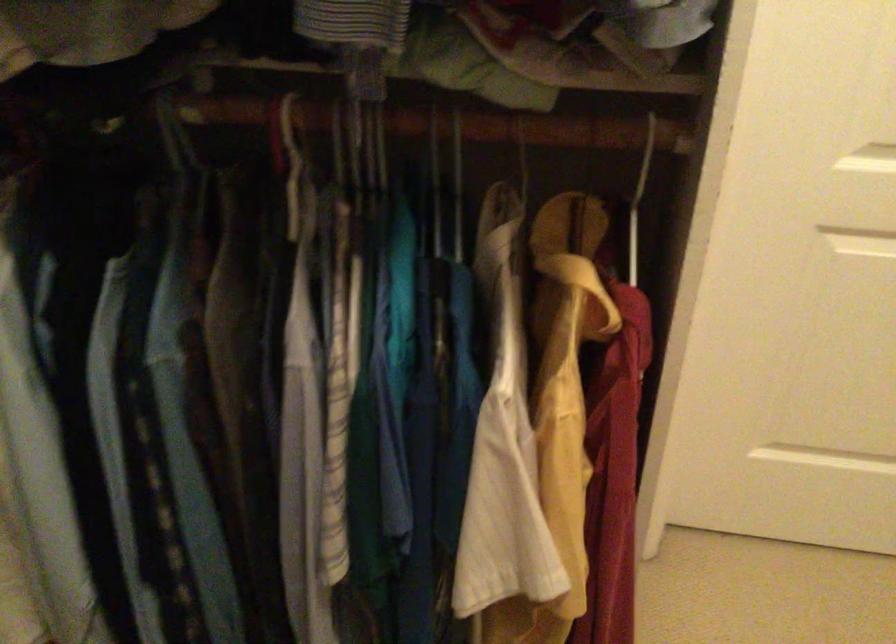
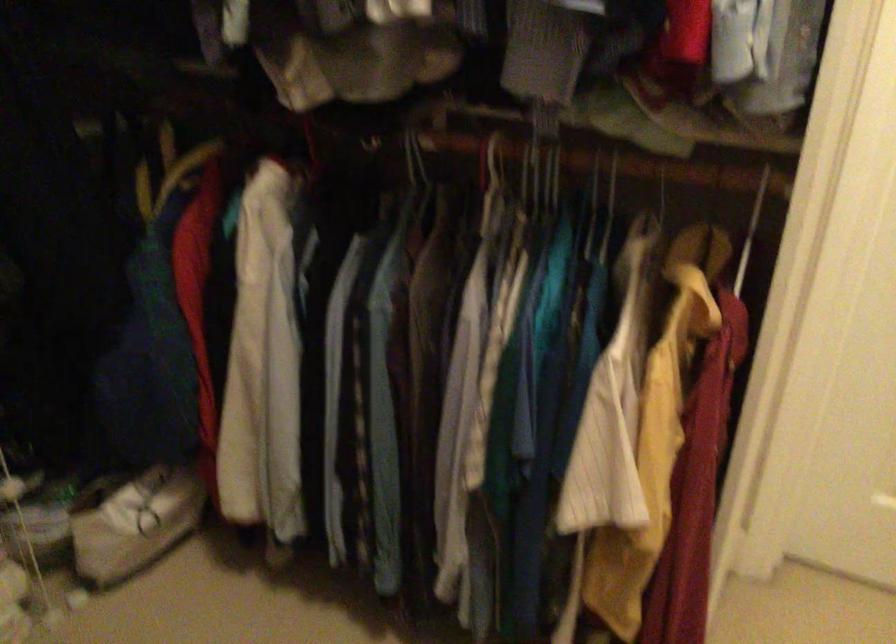
Locate, in the second image, the point that corresponds to point (613, 184) in the first image.

(751, 230)